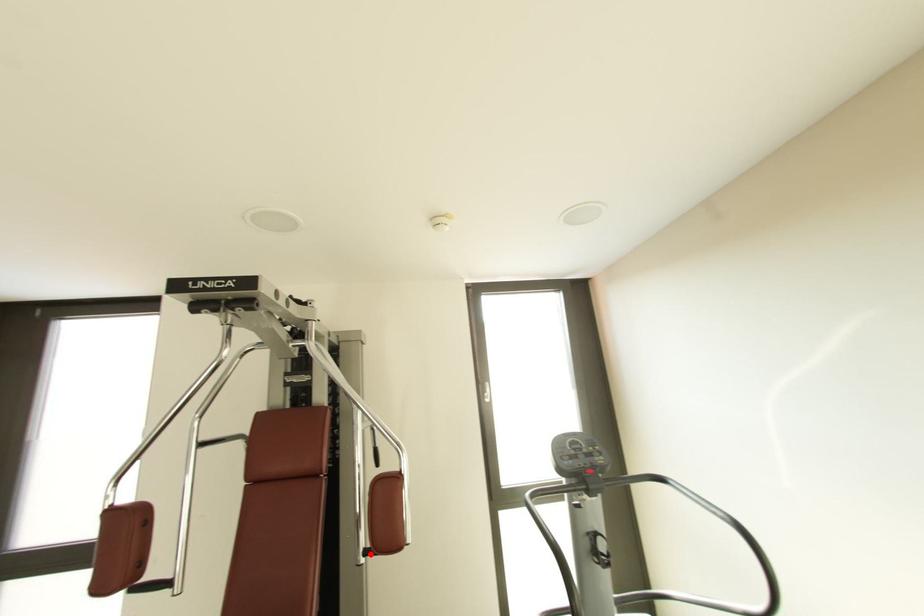
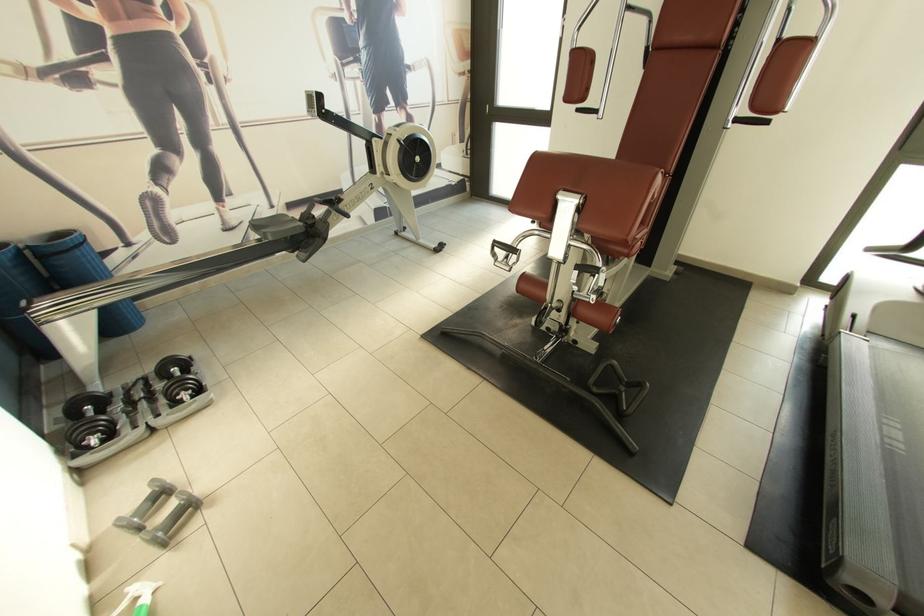
Where in the second image is the point corresponding to the highlighted location from the first image?

(742, 121)